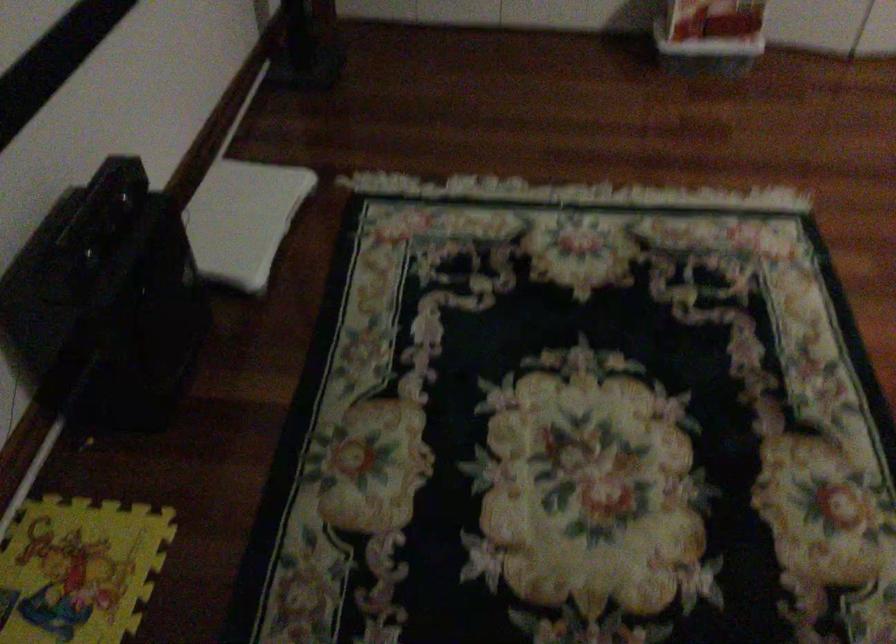
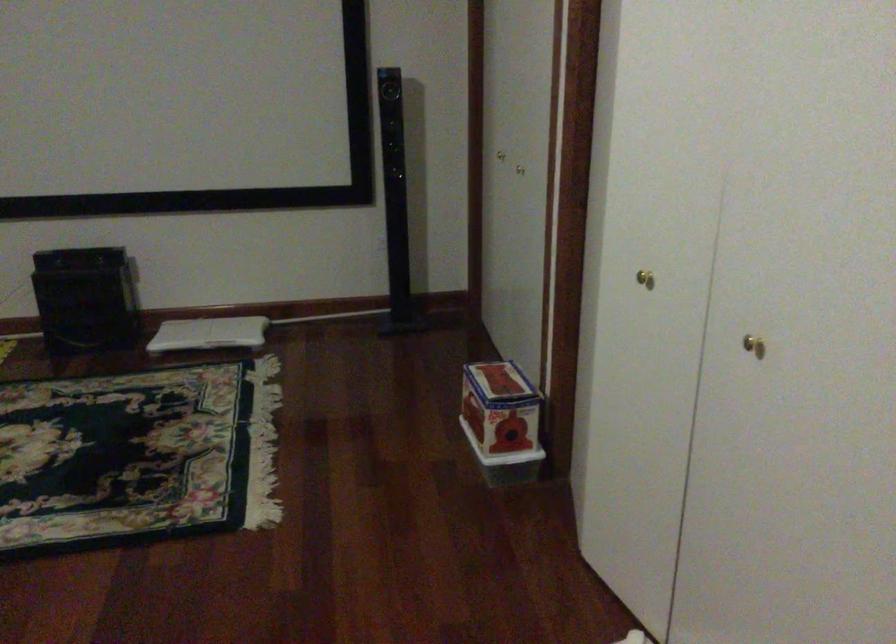
The point at (264,216) is marked in the first image. Where is the corresponding point in the second image?

(209, 333)